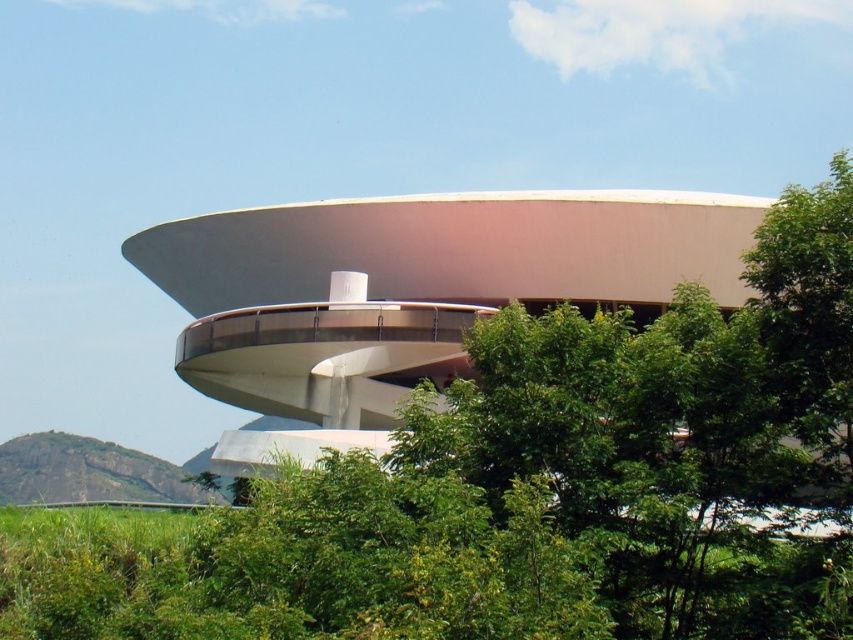
Does white smooth building at center have a lesser width compared to rugged rock at lower left?

No.

Who is more distant from viewer, (318, 323) or (13, 465)?

The point (13, 465) is more distant.

Who is more forward, (740, 230) or (167, 497)?

Point (740, 230) is in front.

Where is `white smooth building at center`? The height and width of the screenshot is (640, 853). white smooth building at center is located at coordinates (409, 291).

From the picture: Can you confirm if white smooth building at center is shorter than green leafy tree at right?

Incorrect, white smooth building at center's height does not fall short of green leafy tree at right's.

Which of these two, white smooth building at center or green leafy tree at right, stands shorter?

green leafy tree at right is shorter.

The image size is (853, 640). I want to click on white smooth building at center, so click(x=409, y=291).

This screenshot has width=853, height=640. I want to click on white smooth building at center, so click(409, 291).

Between point (825, 403) and point (108, 467), which one is positioned in front?

Point (825, 403)

Is green leafy tree at right bigger than rugged rock at lower left?

Yes.

Which is in front, point (846, 218) or point (24, 451)?

Point (846, 218) is in front.

Where is `green leafy tree at right`? Image resolution: width=853 pixels, height=640 pixels. green leafy tree at right is located at coordinates (809, 307).